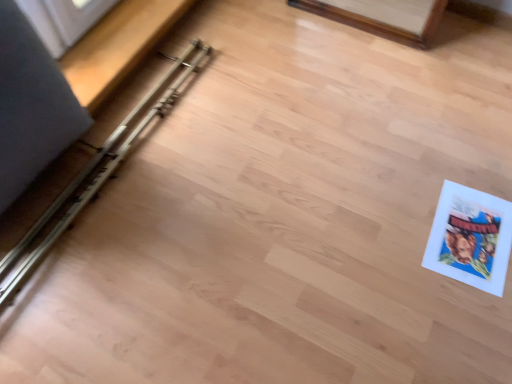
Question: From a real-world perspective, is white paper comic book at lower right positioned above or below metallic silver rail at left?

Choices:
 (A) above
 (B) below

Answer: (B)

Question: In terms of width, does white paper comic book at lower right look wider or thinner when compared to metallic silver rail at left?

Choices:
 (A) thin
 (B) wide

Answer: (A)

Question: Is white paper comic book at lower right to the left or to the right of metallic silver rail at left in the image?

Choices:
 (A) right
 (B) left

Answer: (A)

Question: Which is correct: metallic silver rail at left is inside white paper comic book at lower right, or outside of it?

Choices:
 (A) inside
 (B) outside

Answer: (B)

Question: Would you say metallic silver rail at left is to the left or to the right of white paper comic book at lower right in the picture?

Choices:
 (A) left
 (B) right

Answer: (A)

Question: From a real-world perspective, is metallic silver rail at left positioned above or below white paper comic book at lower right?

Choices:
 (A) below
 (B) above

Answer: (B)

Question: Considering their positions, is metallic silver rail at left located in front of or behind white paper comic book at lower right?

Choices:
 (A) behind
 (B) front

Answer: (B)